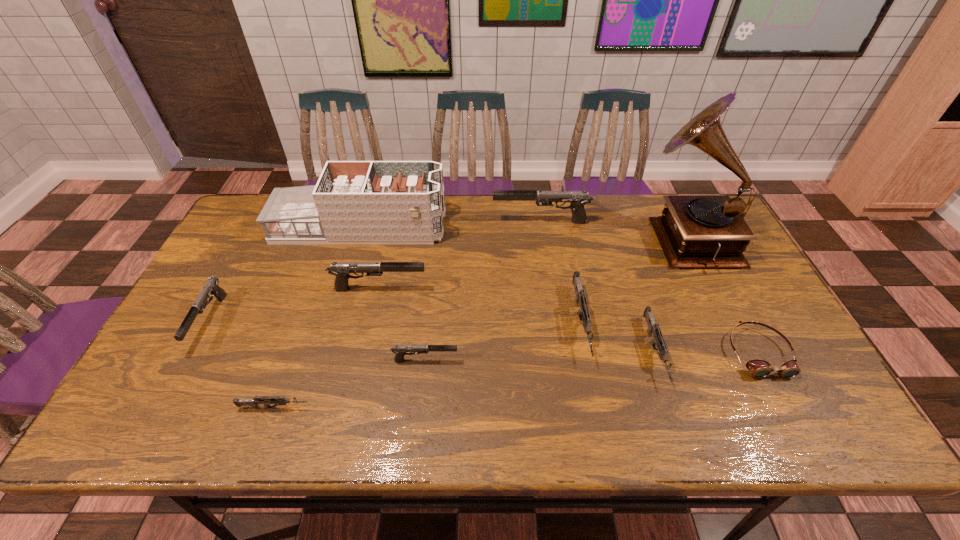
At what (x,y) coordinates should I click in order to perform the action: click on vacant space at the left edge of the desktop. Please return your answer as a coordinate pair (x, y). This screenshot has height=540, width=960. Looking at the image, I should click on (221, 350).

What are the coordinates of `free space at the right edge` in the screenshot? It's located at (747, 318).

This screenshot has height=540, width=960. In order to click on free point at the near left corner in this screenshot , I will do (124, 413).

Find the location of a particular element. free space at the near right corner of the desktop is located at coordinates (790, 418).

Locate an element on the screen. This screenshot has height=540, width=960. free space between the farthest gun and the rightmost grey gun is located at coordinates (598, 287).

The height and width of the screenshot is (540, 960). I want to click on free point between the second biggest grey gun and the second tallest object, so pyautogui.click(x=507, y=289).

I want to click on vacant space that's between the record player and the goggles, so click(722, 295).

Locate an element on the screen. The width and height of the screenshot is (960, 540). vacant area between the brown record player and the second smallest grey gun is located at coordinates (670, 294).

Where is `empty location between the second tallest gun and the brown record player`? empty location between the second tallest gun and the brown record player is located at coordinates (533, 263).

This screenshot has width=960, height=540. I want to click on empty location between the goggles and the dollhouse, so tap(559, 290).